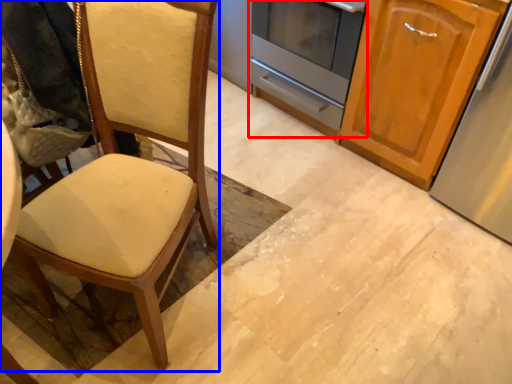
Question: Which object is closer to the camera taking this photo, oven (highlighted by a red box) or chair (highlighted by a blue box)?

Choices:
 (A) oven
 (B) chair

Answer: (B)